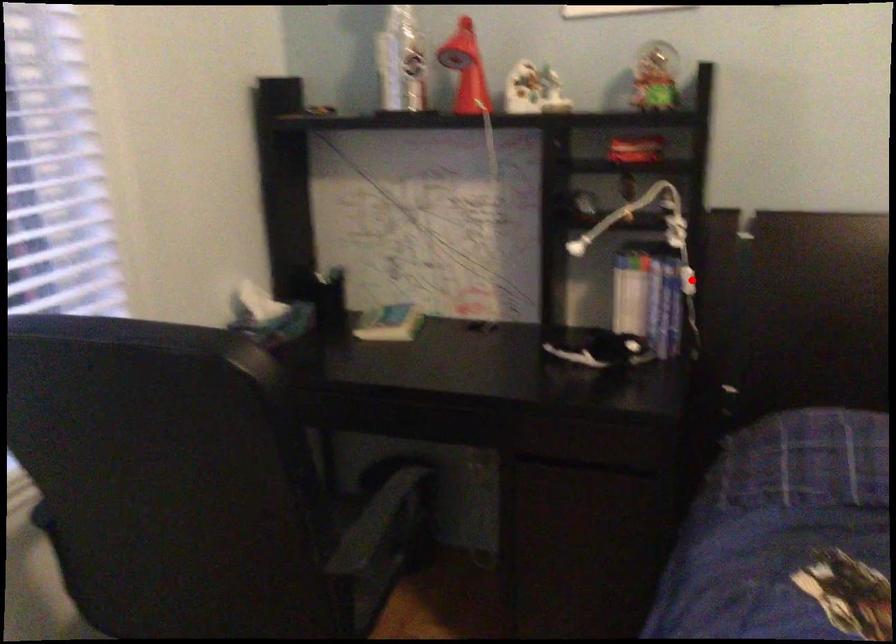
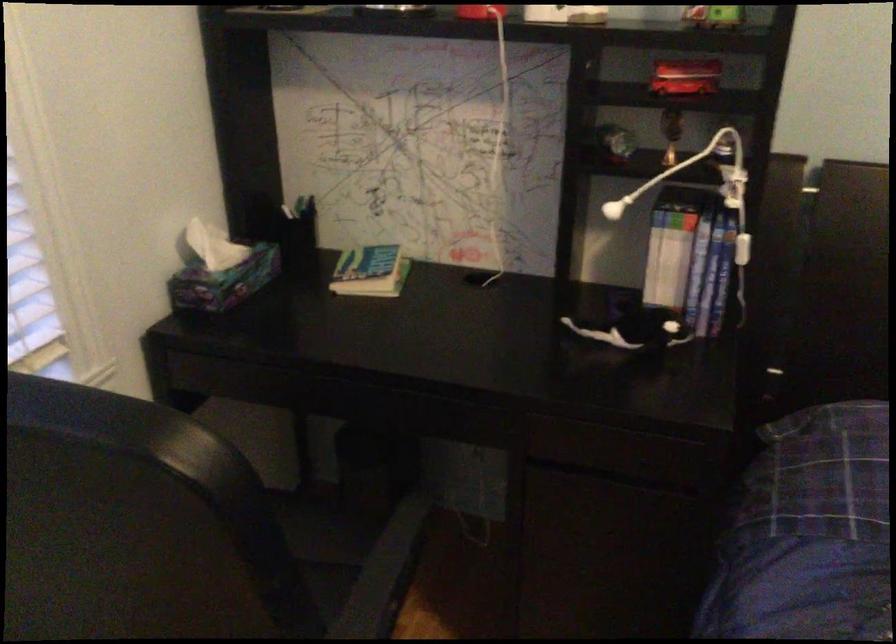
Question: I am providing you with two images of the same scene from different viewpoints. In image1, a red point is highlighted. Considering the same 3D point in image2, which of the following is correct?

Choices:
 (A) It is closer
 (B) It is farther

Answer: (A)